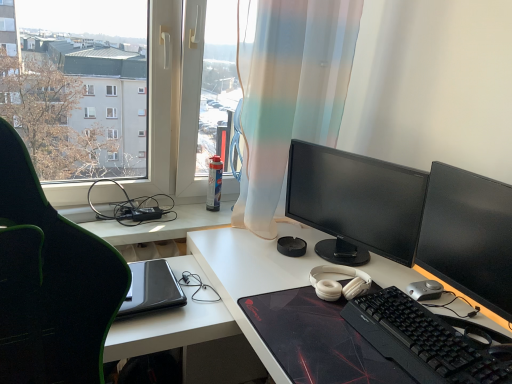
This screenshot has width=512, height=384. I want to click on free point in front of translucent fabric curtain at center, so click(259, 262).